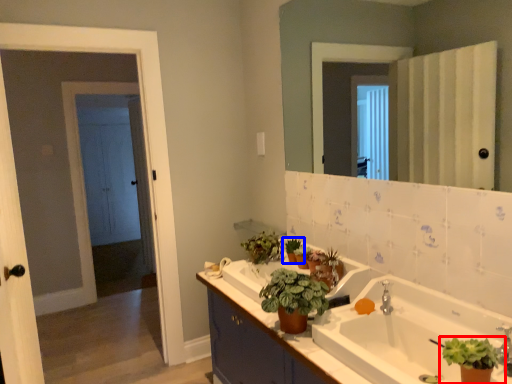
Question: Which of the following is the closest to the observer, houseplant (highlighted by a red box) or houseplant (highlighted by a blue box)?

Choices:
 (A) houseplant
 (B) houseplant

Answer: (A)